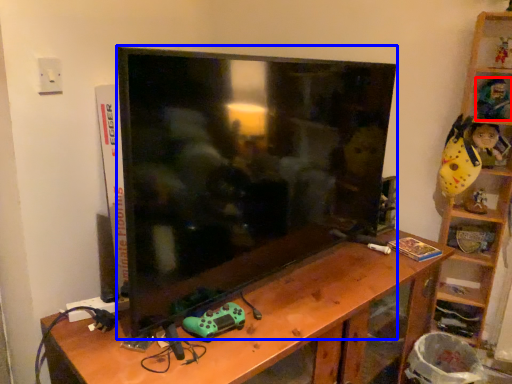
Question: Among these objects, which one is nearest to the camera, toy (highlighted by a red box) or television (highlighted by a blue box)?

Choices:
 (A) toy
 (B) television

Answer: (B)